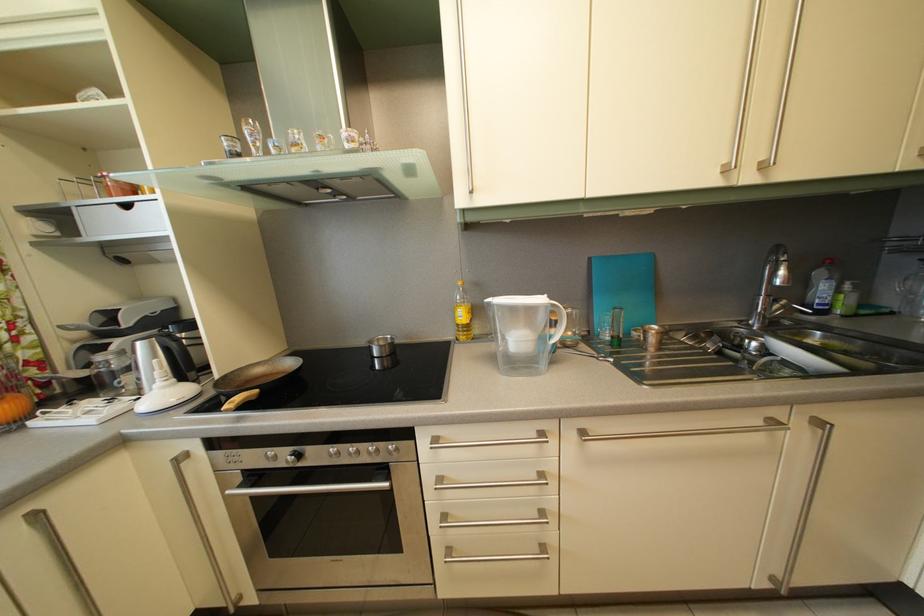
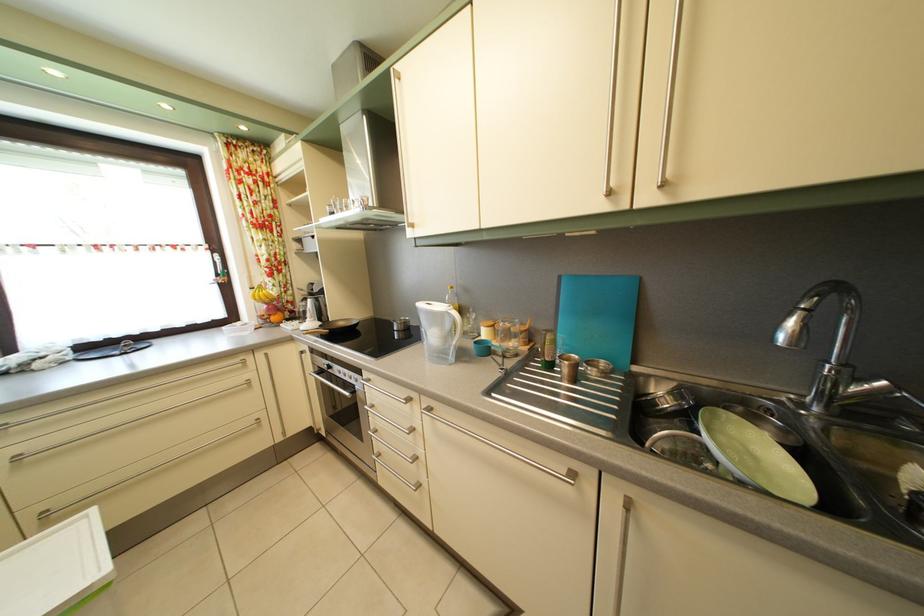
Question: I am providing you with two images of the same scene from different viewpoints. Which of the following objects are not visible in image2?

Choices:
 (A) metal cabinet handle
 (B) green patterned plate
 (C) faucet handle
 (D) none of these

Answer: (D)